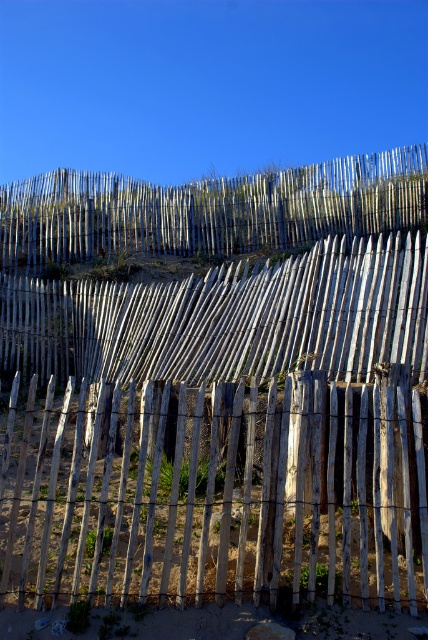
Question: Does weathered wood fence at center have a lesser width compared to weathered wood fence at upper center?

Choices:
 (A) yes
 (B) no

Answer: (A)

Question: In this image, where is weathered wood fence at center located relative to weathered wood fence at upper center?

Choices:
 (A) above
 (B) below

Answer: (B)

Question: Which of the following is the farthest from the observer?

Choices:
 (A) weathered wood fence at upper center
 (B) weathered wood fence at center

Answer: (A)

Question: Is weathered wood fence at center further to camera compared to weathered wood fence at upper center?

Choices:
 (A) no
 (B) yes

Answer: (A)

Question: Which point is closer to the camera?

Choices:
 (A) weathered wood fence at upper center
 (B) weathered wood fence at center

Answer: (B)